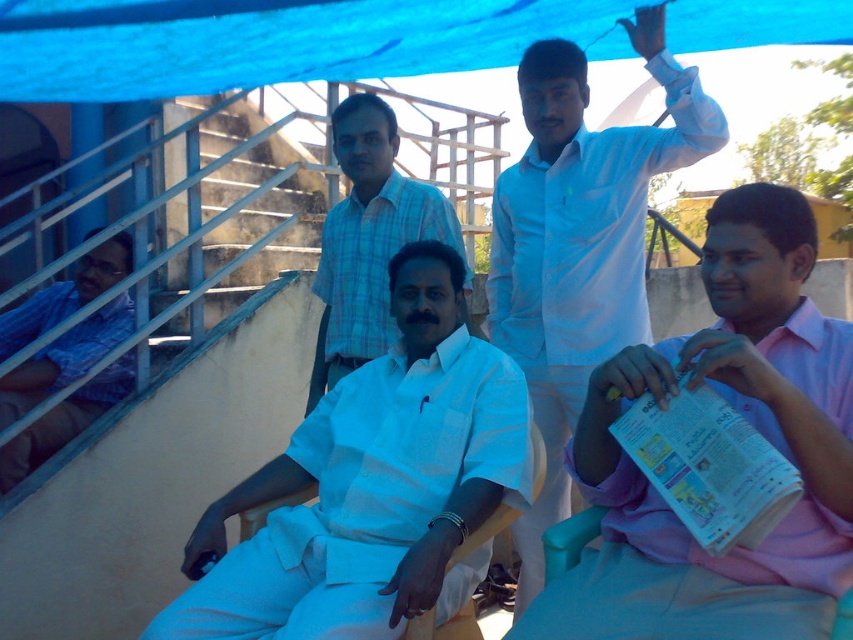
You are a photographer positioned at the back of the scene. You need to take a photo that includes both the pink cotton shirt at lower right and the white cotton kurta at center. Based on their positions, which one should you adjust your camera angle to focus on first to ensure both are in frame?

You should focus on the white cotton kurta at center first since the pink cotton shirt at lower right is to the right of it, so adjusting the angle to include both would require framing from the center outward.

You are a photographer at the event and need to capture a clear photo of both the pink cotton shirt at lower right and the white cotton kurta at center. Which one is closer to the camera?

The pink cotton shirt at lower right is in front of the white cotton kurta at center, so it is closer to the camera.

You are a photographer at the event and need to capture a clear shot of both the pink cotton shirt at lower right and the white cotton kurta at center. Based on their positions, which one is positioned higher in the frame?

The pink cotton shirt at lower right is positioned above the white cotton kurta at center in the frame.